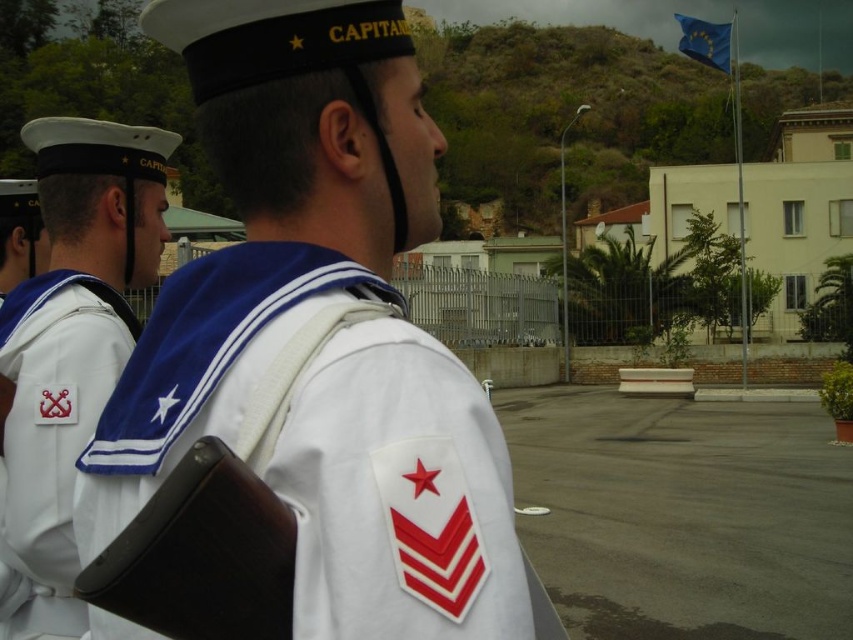
Can you confirm if white matte uniform at center is bigger than blue fabric flag at upper right?

Actually, white matte uniform at center might be smaller than blue fabric flag at upper right.

Which is more to the right, white matte uniform at center or blue fabric flag at upper right?

Positioned to the right is blue fabric flag at upper right.

Is point (281, 532) closer to viewer compared to point (720, 48)?

Yes, it is.

I want to click on white matte uniform at center, so click(x=306, y=364).

Is white matte uniform at center thinner than white fabric patch at left?

Incorrect, white matte uniform at center's width is not less than white fabric patch at left's.

Does white matte uniform at center have a larger size compared to white fabric patch at left?

Yes, white matte uniform at center is bigger than white fabric patch at left.

Locate an element on the screen. The image size is (853, 640). white matte uniform at center is located at coordinates (x=306, y=364).

At what (x,y) coordinates should I click in order to perform the action: click on white matte uniform at center. Please return your answer as a coordinate pair (x, y). The image size is (853, 640). Looking at the image, I should click on (306, 364).

Does white fabric patch at left have a greater height compared to blue fabric flag at upper right?

No.

Is white fabric patch at left shorter than blue fabric flag at upper right?

Yes, white fabric patch at left is shorter than blue fabric flag at upper right.

Which is in front, point (24, 358) or point (689, 49)?

Point (24, 358) is in front.

This screenshot has height=640, width=853. Find the location of `white fabric patch at left`. white fabric patch at left is located at coordinates (x=51, y=435).